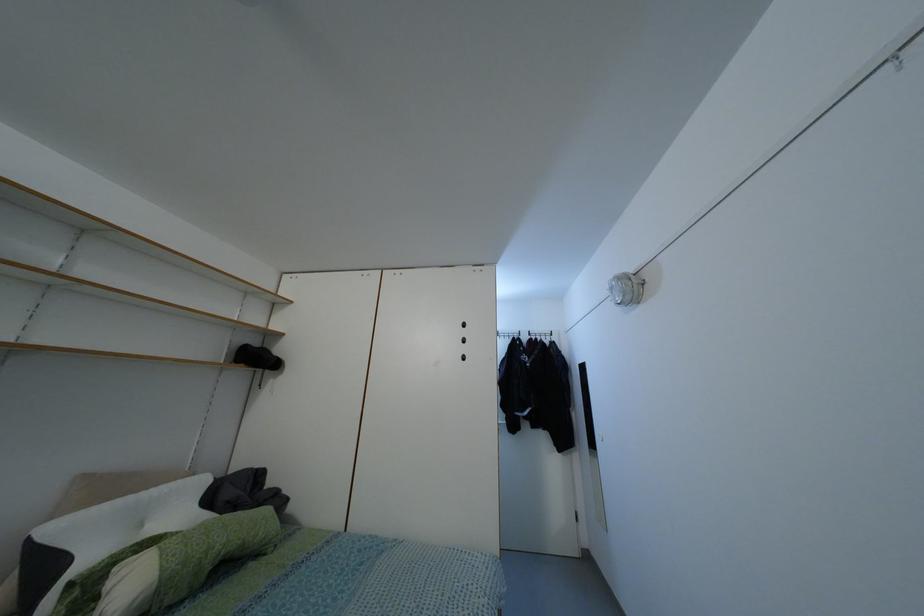
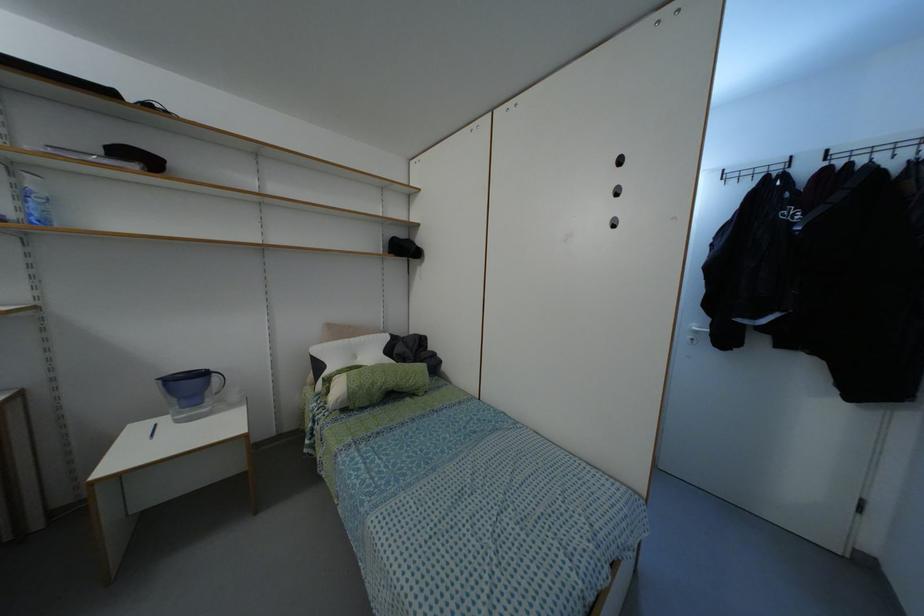
The point at (129, 498) is marked in the first image. Where is the corresponding point in the second image?

(345, 339)